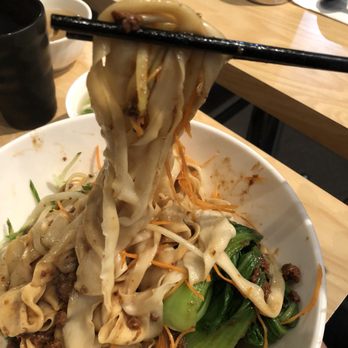
This screenshot has width=348, height=348. What are the coordinates of `wooden table tops` in the screenshot? It's located at pyautogui.click(x=277, y=24), pyautogui.click(x=325, y=223), pyautogui.click(x=323, y=93), pyautogui.click(x=65, y=81).